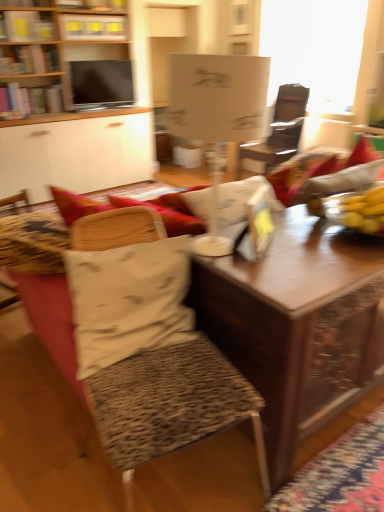
Identify the location of free space above wooden bookshelf at upper center (from a real-world perspective). Image resolution: width=384 pixels, height=512 pixels. (109, 12).